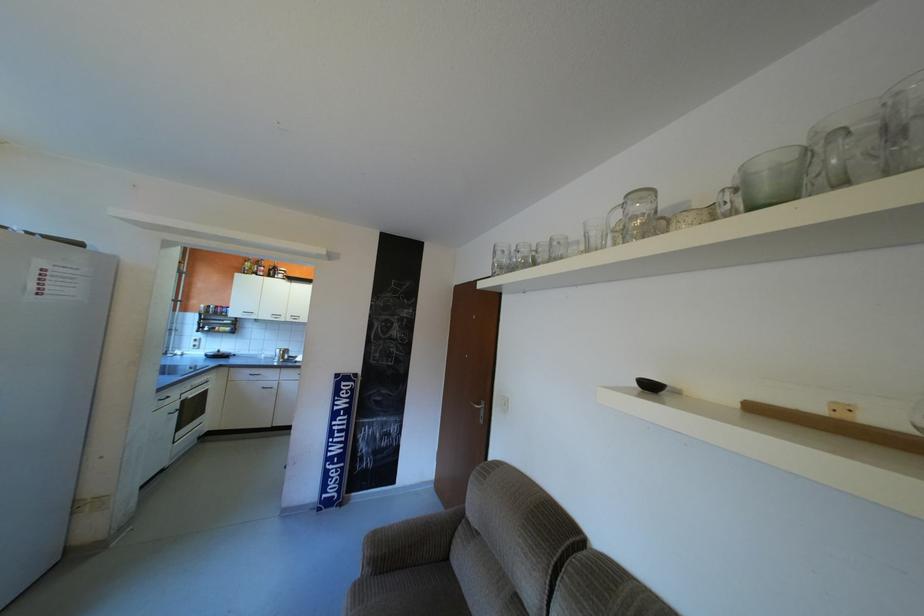
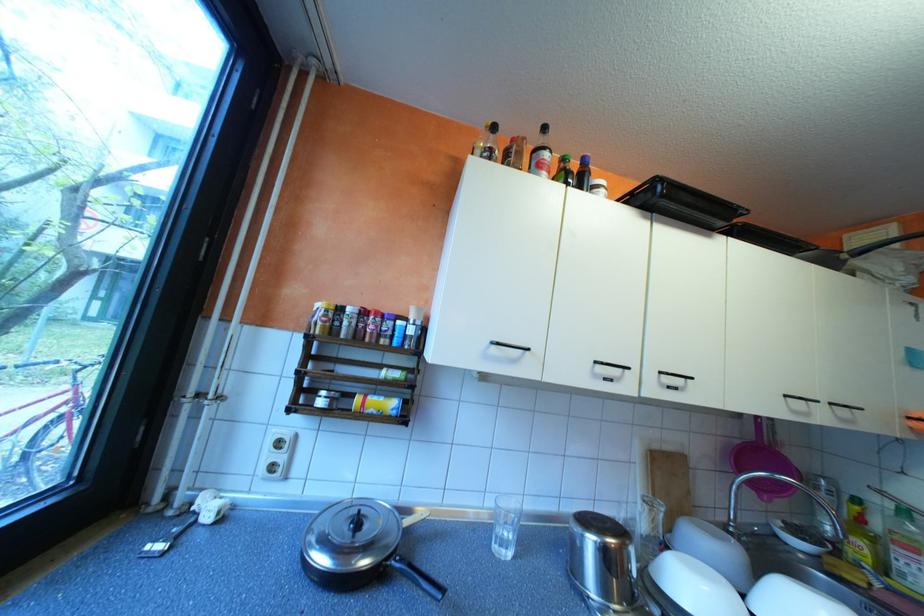
In a continuous first-person perspective shot, in which direction is the camera moving?

The cameraman moved toward left, forward.